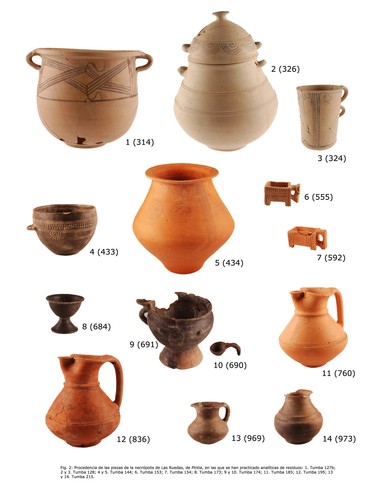
Locate an element on the screen. whole in bottom of brown vase on upper left is located at coordinates (80, 141).